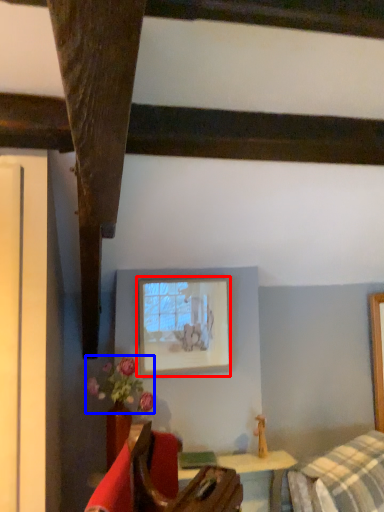
Question: Which object appears farthest to the camera in this image, picture frame (highlighted by a red box) or flower (highlighted by a blue box)?

Choices:
 (A) picture frame
 (B) flower

Answer: (A)